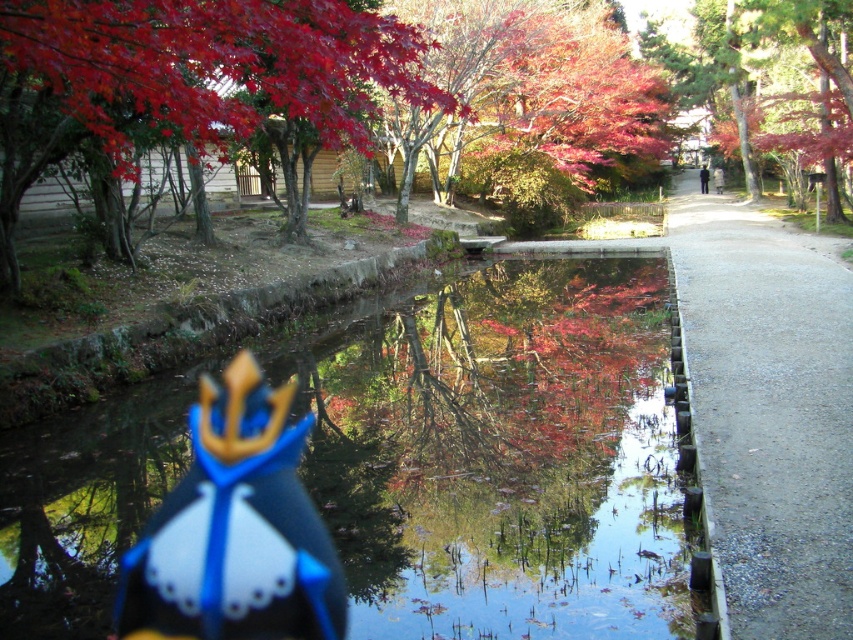
Locate an element on the screen. Image resolution: width=853 pixels, height=640 pixels. transparent plastic puddle at center is located at coordinates (502, 454).

This screenshot has height=640, width=853. Identify the location of transparent plastic puddle at center. (502, 454).

Between gravelly gray path at right and blue fabric toy at center, which one appears on the left side from the viewer's perspective?

From the viewer's perspective, blue fabric toy at center appears more on the left side.

Can you confirm if gravelly gray path at right is shorter than blue fabric toy at center?

No.

Does point (761, 212) come behind point (274, 602)?

Yes, it is behind point (274, 602).

Locate an element on the screen. gravelly gray path at right is located at coordinates (767, 412).

Which of these two, transparent plastic puddle at center or gravelly gray path at right, stands shorter?

transparent plastic puddle at center

Which of these two, transparent plastic puddle at center or gravelly gray path at right, stands taller?

gravelly gray path at right is taller.

Who is more forward, (503, 452) or (750, 486)?

Point (750, 486) is more forward.

I want to click on transparent plastic puddle at center, so click(x=502, y=454).